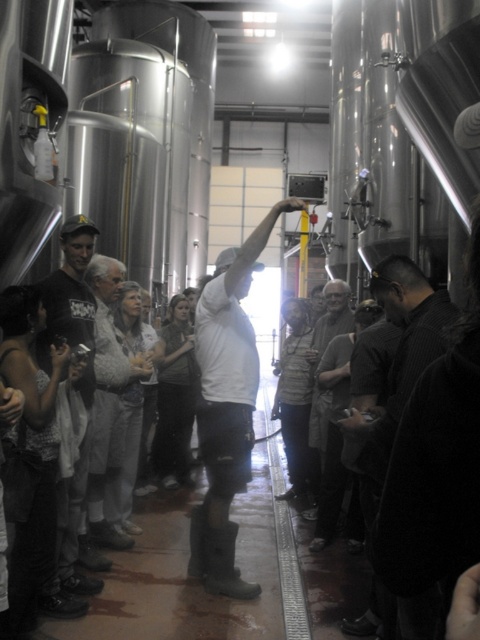
Can you confirm if white matte shirt at center is taller than gray knit sweater at center?

Yes.

Is white matte shirt at center to the left of gray knit sweater at center from the viewer's perspective?

Indeed, white matte shirt at center is positioned on the left side of gray knit sweater at center.

Is point (239, 285) positioned behind point (317, 480)?

No, (239, 285) is closer to viewer.

The image size is (480, 640). Identify the location of white matte shirt at center. (227, 406).

How distant is white matte shirt at center from dark gray shirt at center?

A distance of 78.42 centimeters exists between white matte shirt at center and dark gray shirt at center.

Does white matte shirt at center have a lesser height compared to dark gray shirt at center?

In fact, white matte shirt at center may be taller than dark gray shirt at center.

The image size is (480, 640). Find the location of `white matte shirt at center`. white matte shirt at center is located at coordinates (227, 406).

This screenshot has height=640, width=480. What are the coordinates of `white matte shirt at center` in the screenshot? It's located at (227, 406).

Where is `white matte shirt at center`? This screenshot has height=640, width=480. white matte shirt at center is located at coordinates (227, 406).

This screenshot has height=640, width=480. What are the coordinates of `white matte shirt at center` in the screenshot? It's located at (227, 406).